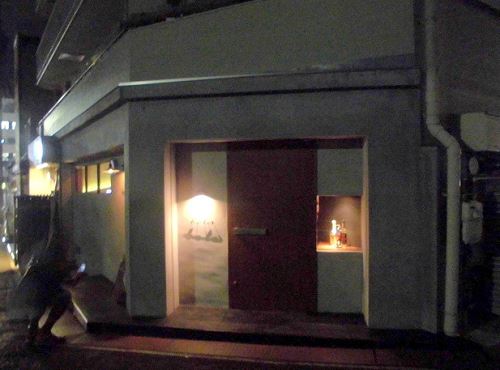
This screenshot has height=370, width=500. I want to click on red door, so click(251, 279), click(247, 177), click(294, 177), click(294, 280).